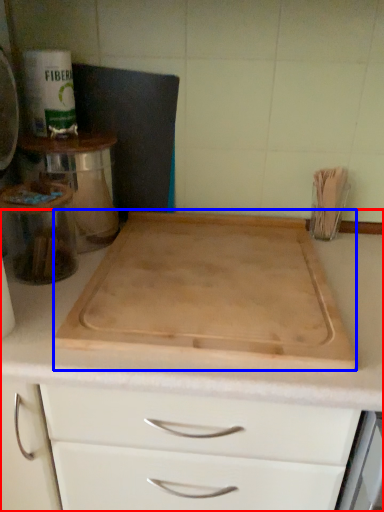
Question: Which object is further to the camera taking this photo, countertop (highlighted by a red box) or cutting board (highlighted by a blue box)?

Choices:
 (A) countertop
 (B) cutting board

Answer: (B)